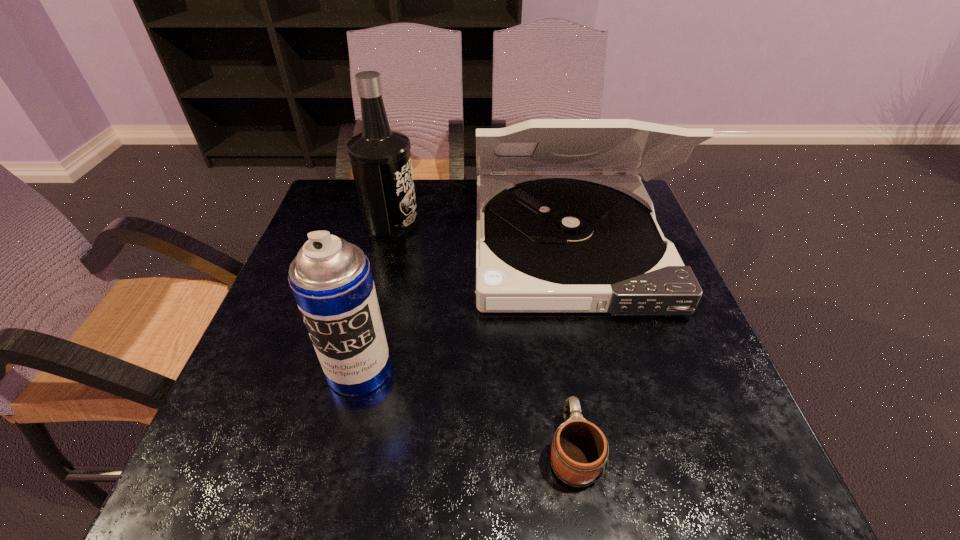
Find the location of a particular element. This screenshot has height=540, width=960. free location located on the side of the mug with the handle is located at coordinates (548, 295).

Locate an element on the screen. Image resolution: width=960 pixels, height=540 pixels. liquor that is at the far edge is located at coordinates (380, 158).

Identify the location of CD player at the far edge. The width and height of the screenshot is (960, 540). (545, 243).

Find the location of a particular element. The image size is (960, 540). object present at the near edge is located at coordinates (579, 451).

Find the location of a particular element. Image resolution: width=960 pixels, height=540 pixels. liquor at the left edge is located at coordinates (380, 158).

Image resolution: width=960 pixels, height=540 pixels. What are the coordinates of `aerosol can located in the left edge section of the desktop` in the screenshot? It's located at point(331,279).

Locate an element on the screen. object present at the right edge is located at coordinates (545, 243).

At what (x,y) coordinates should I click in order to perform the action: click on object that is at the far left corner. Please return your answer as a coordinate pair (x, y). The image size is (960, 540). Looking at the image, I should click on (380, 158).

Where is `object at the far right corner`? The image size is (960, 540). object at the far right corner is located at coordinates (545, 243).

In the image, there is a desktop. Where is `vacant space at the near edge`? The image size is (960, 540). vacant space at the near edge is located at coordinates (433, 500).